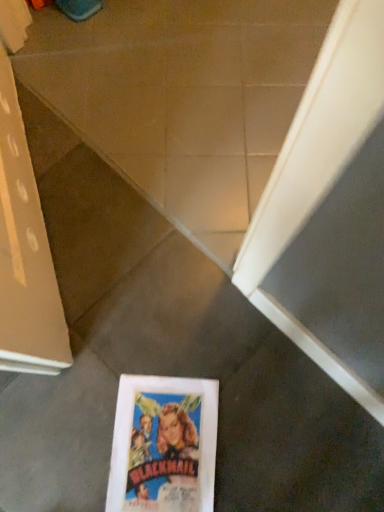
Find the location of a particular element. The image size is (384, 512). empty space that is ontop of white glossy concrete at center is located at coordinates (195, 72).